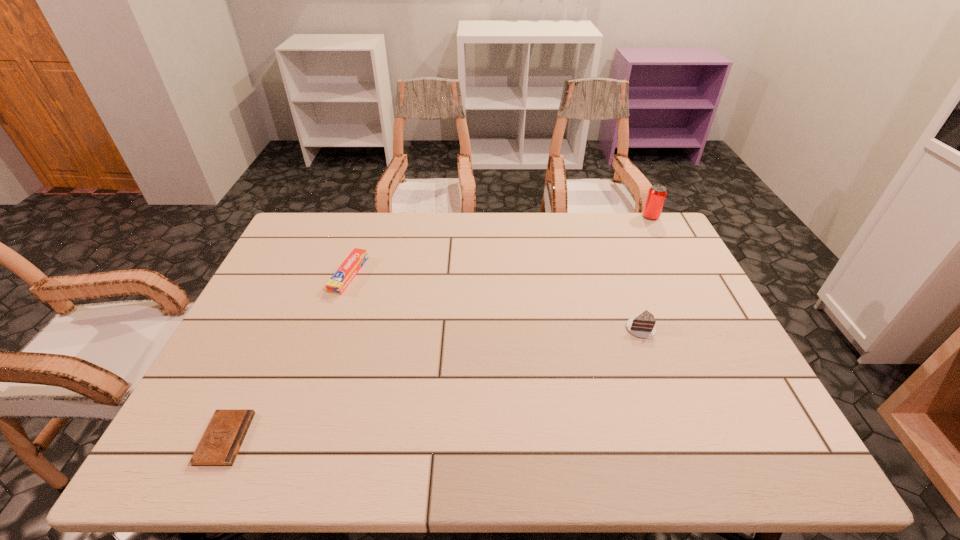
This screenshot has height=540, width=960. Identify the location of vacant space located on the front of the second shortest object. (336, 313).

The height and width of the screenshot is (540, 960). Find the location of `free spot located 0.190m on the spine side of the shortest object`. free spot located 0.190m on the spine side of the shortest object is located at coordinates (334, 438).

At what (x,y) coordinates should I click in order to perform the action: click on object located at the far edge. Please return your answer as a coordinate pair (x, y). This screenshot has width=960, height=540. Looking at the image, I should click on pyautogui.click(x=657, y=193).

Image resolution: width=960 pixels, height=540 pixels. I want to click on object positioned at the near edge, so click(x=223, y=437).

The height and width of the screenshot is (540, 960). I want to click on object present at the left edge, so click(x=223, y=437).

This screenshot has width=960, height=540. What are the coordinates of `object located in the right edge section of the desktop` in the screenshot? It's located at tap(657, 193).

The width and height of the screenshot is (960, 540). I want to click on object at the near left corner, so click(223, 437).

I want to click on object that is positioned at the far right corner, so click(657, 193).

Where is `blank space at the far edge`? This screenshot has width=960, height=540. blank space at the far edge is located at coordinates (521, 242).

In the image, there is a desktop. What are the coordinates of `vacant space at the near edge` in the screenshot? It's located at (702, 458).